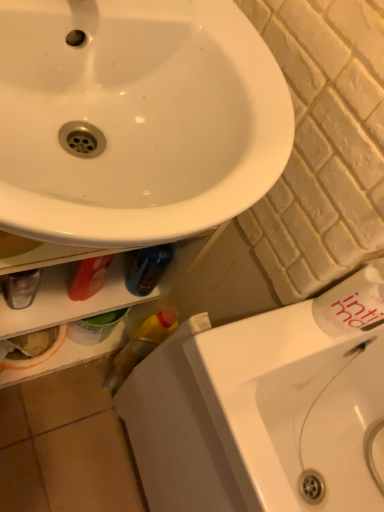
In order to click on white matte bottle at upper right in this screenshot , I will do `click(352, 302)`.

The height and width of the screenshot is (512, 384). What do you see at coordinates (293, 406) in the screenshot?
I see `white glossy sink at lower right` at bounding box center [293, 406].

Locate an element on the screen. white matte bottle at upper right is located at coordinates (352, 302).

How different are the orientations of white textured brick at center right and white glossy sink at upper left in degrees?

white textured brick at center right and white glossy sink at upper left are facing 45.9 degrees away from each other.

How much distance is there between white textured brick at center right and white glossy sink at upper left?

7.55 inches.

Does white textured brick at center right have a lesser width compared to white glossy sink at upper left?

Indeed, white textured brick at center right has a lesser width compared to white glossy sink at upper left.

Considering the sizes of white textured brick at center right and white glossy sink at upper left in the image, is white textured brick at center right taller or shorter than white glossy sink at upper left?

Considering their sizes, white textured brick at center right has more height than white glossy sink at upper left.

From a real-world perspective, relative to white glossy sink at lower right, is white glossy sink at upper left vertically above or below?

white glossy sink at upper left is above white glossy sink at lower right.

How many degrees apart are the facing directions of white glossy sink at upper left and white glossy sink at lower right?

93.8 degrees separate the facing orientations of white glossy sink at upper left and white glossy sink at lower right.

Is white glossy sink at upper left positioned far away from white glossy sink at lower right?

white glossy sink at upper left is near white glossy sink at lower right, not far away.

Would you say white matte bottle at upper right is to the left or to the right of white glossy sink at upper left in the picture?

In the image, white matte bottle at upper right appears on the right side of white glossy sink at upper left.

From the image's perspective, between white matte bottle at upper right and white glossy sink at upper left, which one is located above?

From the image's view, white glossy sink at upper left is above.

Which of these two, white matte bottle at upper right or white glossy sink at upper left, is bigger?

With larger size is white glossy sink at upper left.

Where is `toiletry located below the white glossy sink at upper left (from the image's perspective)`? The image size is (384, 512). toiletry located below the white glossy sink at upper left (from the image's perspective) is located at coordinates (352, 302).

Between white glossy sink at lower right and white matte bottle at upper right, which one appears on the left side from the viewer's perspective?

white matte bottle at upper right.

Is white matte bottle at upper right completely or partially inside white glossy sink at lower right?

No, white matte bottle at upper right is not a part of white glossy sink at lower right.

Is white glossy sink at lower right shorter than white matte bottle at upper right?

No, white glossy sink at lower right is not shorter than white matte bottle at upper right.

Can you confirm if white textured brick at center right is taller than white matte bottle at upper right?

Yes.

Which object is closer to the camera, white textured brick at center right or white matte bottle at upper right?

white textured brick at center right is in front.

Consider the image. Considering the relative sizes of white textured brick at center right and white matte bottle at upper right in the image provided, is white textured brick at center right bigger than white matte bottle at upper right?

Correct, white textured brick at center right is larger in size than white matte bottle at upper right.

Is white textured brick at center right looking in the opposite direction of white matte bottle at upper right?

white textured brick at center right does not have its back to white matte bottle at upper right.

From the image's perspective, which is below, white matte bottle at upper right or white textured brick at center right?

white matte bottle at upper right appears lower in the image.

Identify the location of toiletry that is above the white textured brick at center right (from a real-world perspective). This screenshot has width=384, height=512. (352, 302).

Is white textured brick at center right at the back of white matte bottle at upper right?

No, white textured brick at center right is not at the back of white matte bottle at upper right.

In the scene shown: From a real-world perspective, is white glossy sink at upper left positioned under white textured brick at center right based on gravity?

Actually, white glossy sink at upper left is physically above white textured brick at center right in the real world.

Considering the sizes of white glossy sink at upper left and white textured brick at center right in the image, is white glossy sink at upper left taller or shorter than white textured brick at center right?

white glossy sink at upper left is shorter than white textured brick at center right.

From the image's perspective, which one is positioned higher, white glossy sink at upper left or white textured brick at center right?

From the image's view, white textured brick at center right is above.

Find the location of a particular element. Image resolution: width=384 pixels, height=512 pixels. brick above the white glossy sink at upper left (from the image's perspective) is located at coordinates (323, 144).

Where is `counter top below the white glossy sink at upper left (from the image's perspective)`? This screenshot has width=384, height=512. counter top below the white glossy sink at upper left (from the image's perspective) is located at coordinates (293, 406).

Based on their spatial positions, is white matte bottle at upper right or white glossy sink at lower right closer to white textured brick at center right?

white matte bottle at upper right.

From the image, which object appears to be farther from white glossy sink at lower right, white glossy sink at upper left or white textured brick at center right?

white glossy sink at upper left is further to white glossy sink at lower right.

When comparing their distances from white matte bottle at upper right, does white textured brick at center right or white glossy sink at upper left seem closer?

Among the two, white textured brick at center right is located nearer to white matte bottle at upper right.

Considering their positions, is white glossy sink at lower right positioned further to white textured brick at center right than white glossy sink at upper left?

Among the two, white glossy sink at lower right is located further to white textured brick at center right.

Estimate the real-world distances between objects in this image. Which object is further from white textured brick at center right, white glossy sink at upper left or white matte bottle at upper right?

Among the two, white glossy sink at upper left is located further to white textured brick at center right.

Based on their spatial positions, is white glossy sink at upper left or white glossy sink at lower right closer to white matte bottle at upper right?

Based on the image, white glossy sink at lower right appears to be nearer to white matte bottle at upper right.

Considering their positions, is white matte bottle at upper right positioned further to white textured brick at center right than white glossy sink at upper left?

Among the two, white glossy sink at upper left is located further to white textured brick at center right.

When comparing their distances from white glossy sink at lower right, does white textured brick at center right or white matte bottle at upper right seem further?

white textured brick at center right is further to white glossy sink at lower right.

The width and height of the screenshot is (384, 512). Find the location of `toiletry that lies between white glossy sink at upper left and white glossy sink at lower right from top to bottom`. toiletry that lies between white glossy sink at upper left and white glossy sink at lower right from top to bottom is located at coordinates (352, 302).

This screenshot has height=512, width=384. Identify the location of brick between white glossy sink at upper left and white matte bottle at upper right in the horizontal direction. (323, 144).

Find the location of a particular element. sink that lies between white textured brick at center right and white glossy sink at lower right from top to bottom is located at coordinates (136, 119).

The image size is (384, 512). Identify the location of toiletry between white textured brick at center right and white glossy sink at lower right in the up-down direction. (352, 302).